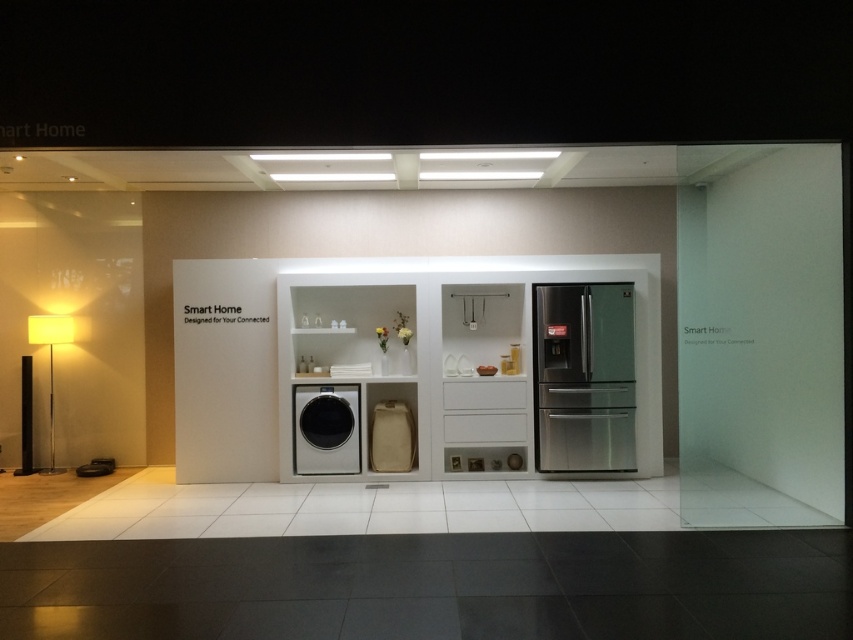
Question: Which object is closer to the camera taking this photo?

Choices:
 (A) stainless steel refrigerator at center
 (B) sleek metallic washing machine at center

Answer: (B)

Question: Is stainless steel refrigerator at center to the left of sleek metallic washing machine at center from the viewer's perspective?

Choices:
 (A) yes
 (B) no

Answer: (B)

Question: Which of these objects is positioned farthest from the sleek metallic washing machine at center?

Choices:
 (A) matte white floor lamp at left
 (B) stainless steel refrigerator at center

Answer: (A)

Question: Based on their relative distances, which object is farther from the matte white floor lamp at left?

Choices:
 (A) sleek metallic washing machine at center
 (B) stainless steel refrigerator at center

Answer: (B)

Question: In this image, where is stainless steel refrigerator at center located relative to sleek metallic washing machine at center?

Choices:
 (A) right
 (B) left

Answer: (A)

Question: Is stainless steel refrigerator at center wider than sleek metallic washing machine at center?

Choices:
 (A) no
 (B) yes

Answer: (B)